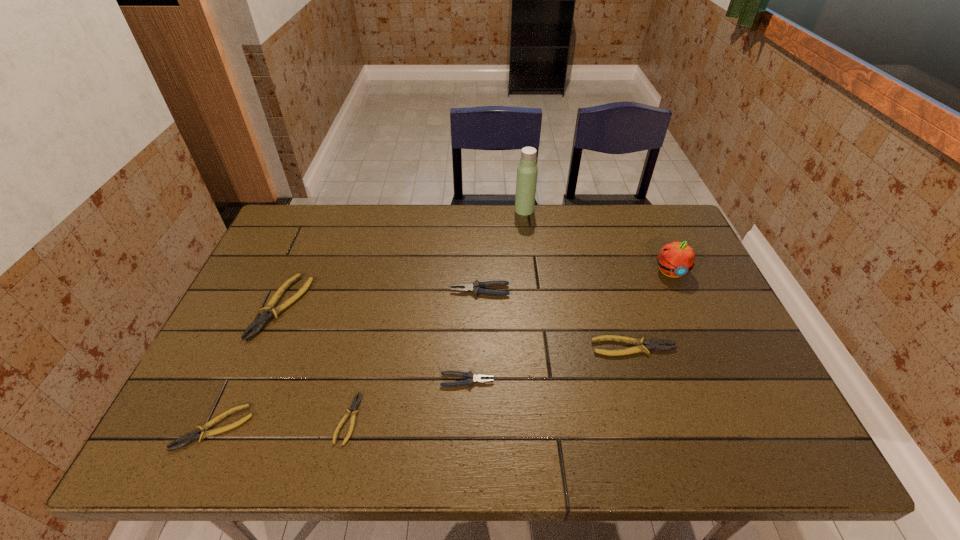
This screenshot has height=540, width=960. In order to click on vacant region between the shortest pliers and the farther gray pliers in this screenshot , I will do `click(414, 355)`.

At what (x,y) coordinates should I click in order to perform the action: click on empty space that is in between the farther gray pliers and the second shortest pliers. Please return your answer as a coordinate pair (x, y). The width and height of the screenshot is (960, 540). Looking at the image, I should click on (348, 359).

Where is `vacant space that's between the second biggest yellow pliers and the biggest yellow pliers`? vacant space that's between the second biggest yellow pliers and the biggest yellow pliers is located at coordinates click(x=458, y=327).

Choose which object is the seventh nearest neighbor to the rightmost object. Please provide its 2D coordinates. Your answer should be formatted as a tuple, i.e. [(x, y)], where the tuple contains the x and y coordinates of a point satisfying the conditions above.

[(195, 435)]

Identify the location of the sixth closest object to the fifth tallest pliers. The width and height of the screenshot is (960, 540). (527, 170).

Where is `pliers that is the fourth closest one to the rightmost object`? The height and width of the screenshot is (540, 960). pliers that is the fourth closest one to the rightmost object is located at coordinates (355, 403).

Locate which pliers ranks fourth in proximity to the seventh shortest object. Please provide its 2D coordinates. Your answer should be formatted as a tuple, i.e. [(x, y)], where the tuple contains the x and y coordinates of a point satisfying the conditions above.

[(355, 403)]

Select which yellow pliers appears as the closest to the biggest yellow pliers. Please provide its 2D coordinates. Your answer should be formatted as a tuple, i.e. [(x, y)], where the tuple contains the x and y coordinates of a point satisfying the conditions above.

[(195, 435)]

Find the location of a particular element. yellow pliers that can be found as the closest to the second shortest object is located at coordinates (269, 311).

This screenshot has height=540, width=960. I want to click on free space that satisfies the following two spatial constraints: 1. on the front side of the third smallest yellow pliers; 2. at the gripping part of the nearer gray pliers, so click(644, 381).